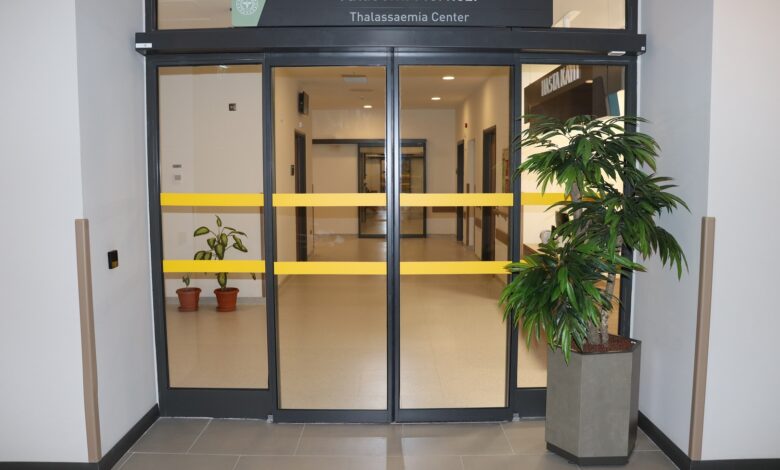
At what (x,y) coordinates should I click in order to perform the action: click on sign inside building. Please return your answer as a coordinate pair (x, y). Image resolution: width=780 pixels, height=470 pixels. Looking at the image, I should click on (558, 78).